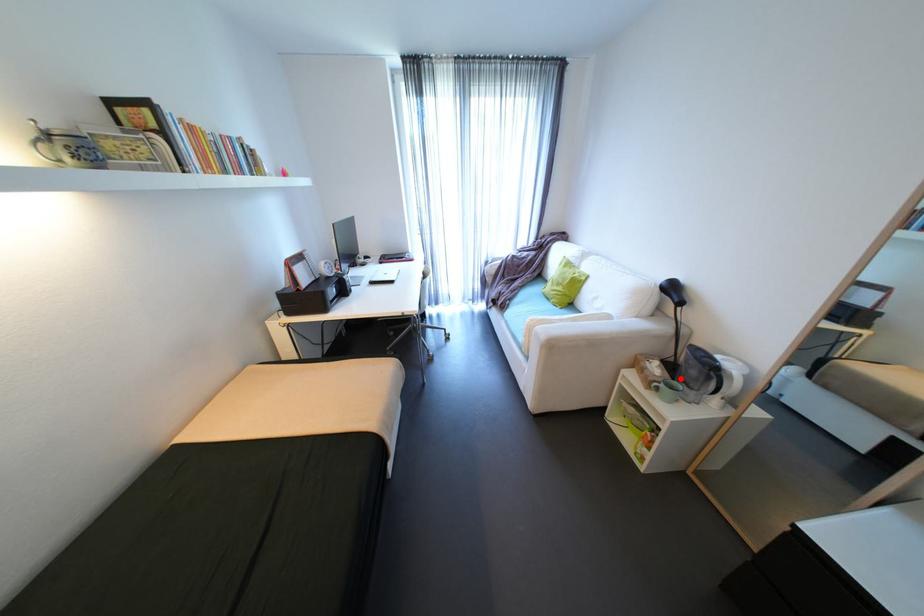
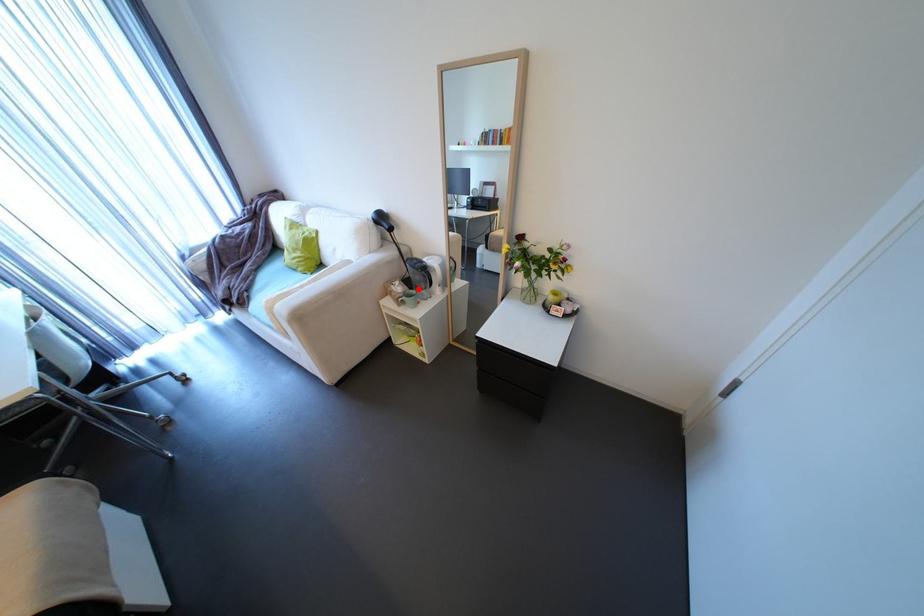
From the picture: I am providing you with two images of the same scene from different viewpoints. A red point is marked on the first image and another point is marked on the second image. Is the red point in image1 aligned with the point shown in image2?

Yes